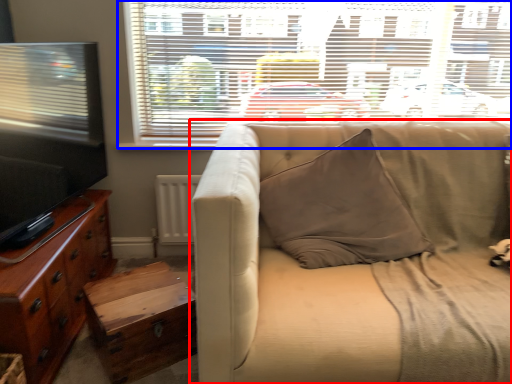
Question: Which object appears closest to the camera in this image, studio couch (highlighted by a red box) or window (highlighted by a blue box)?

Choices:
 (A) studio couch
 (B) window

Answer: (A)